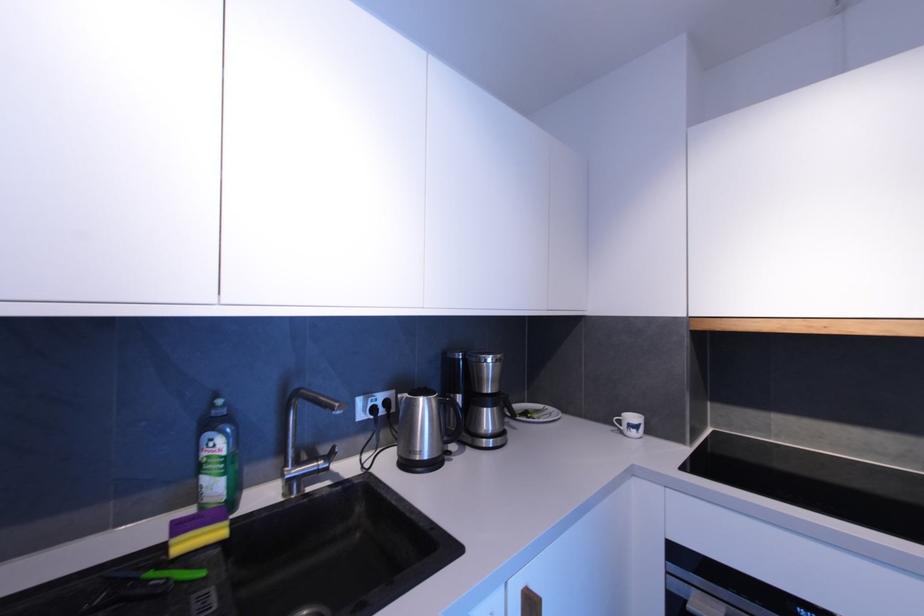
Find where to lift the faucet. Please return your answer as a coordinate pair (x, y).

(304, 416)